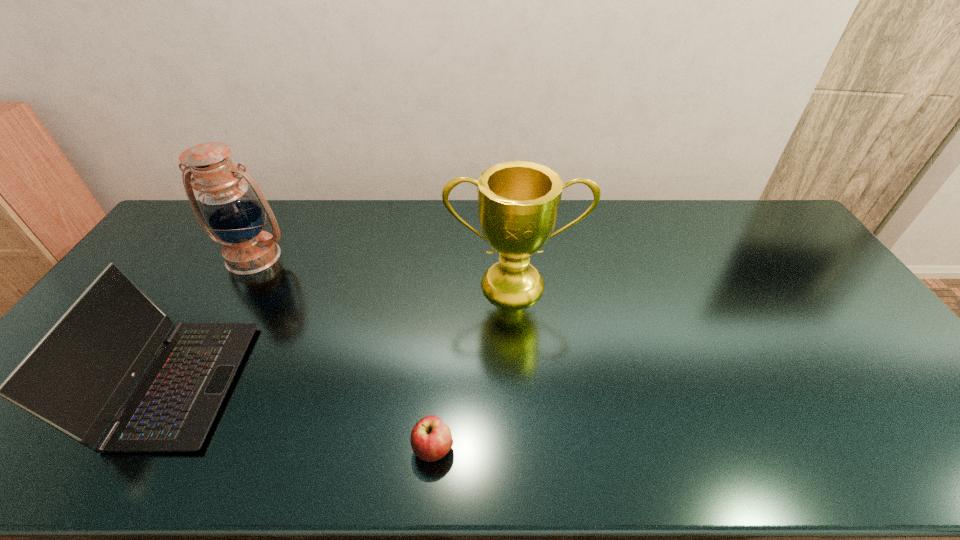
At what (x,y) coordinates should I click in order to perform the action: click on vacant region between the apple and the oil lamp. Please return your answer as a coordinate pair (x, y). The image size is (960, 540). Looking at the image, I should click on (344, 353).

Where is `free area in between the second shortest object and the apple`? free area in between the second shortest object and the apple is located at coordinates (306, 416).

Where is `free space between the oil lamp and the third tallest object`? The height and width of the screenshot is (540, 960). free space between the oil lamp and the third tallest object is located at coordinates (216, 320).

The width and height of the screenshot is (960, 540). In order to click on free space between the oil lamp and the apple in this screenshot , I will do `click(344, 353)`.

Locate an element on the screen. The height and width of the screenshot is (540, 960). object that is the second closest one to the shortest object is located at coordinates (76, 378).

Identify which object is the third closest to the award. Please provide its 2D coordinates. Your answer should be formatted as a tuple, i.e. [(x, y)], where the tuple contains the x and y coordinates of a point satisfying the conditions above.

[(232, 208)]

This screenshot has height=540, width=960. What are the coordinates of `vacant area in the image that satisfies the following two spatial constraints: 1. on the screen of the shortest object; 2. on the right side of the third tallest object` in the screenshot? It's located at (142, 448).

Where is `vacant space that satisfies the following two spatial constraints: 1. on the shiny surface of the award; 2. on the screen of the second shortest object`? vacant space that satisfies the following two spatial constraints: 1. on the shiny surface of the award; 2. on the screen of the second shortest object is located at coordinates (523, 383).

Where is `blank area in the image that satisfies the following two spatial constraints: 1. on the shiny surface of the award; 2. on the screen of the laptop computer`? This screenshot has width=960, height=540. blank area in the image that satisfies the following two spatial constraints: 1. on the shiny surface of the award; 2. on the screen of the laptop computer is located at coordinates (523, 383).

Identify the location of free location that satisfies the following two spatial constraints: 1. on the screen of the laptop computer; 2. on the right side of the shortest object. (142, 448).